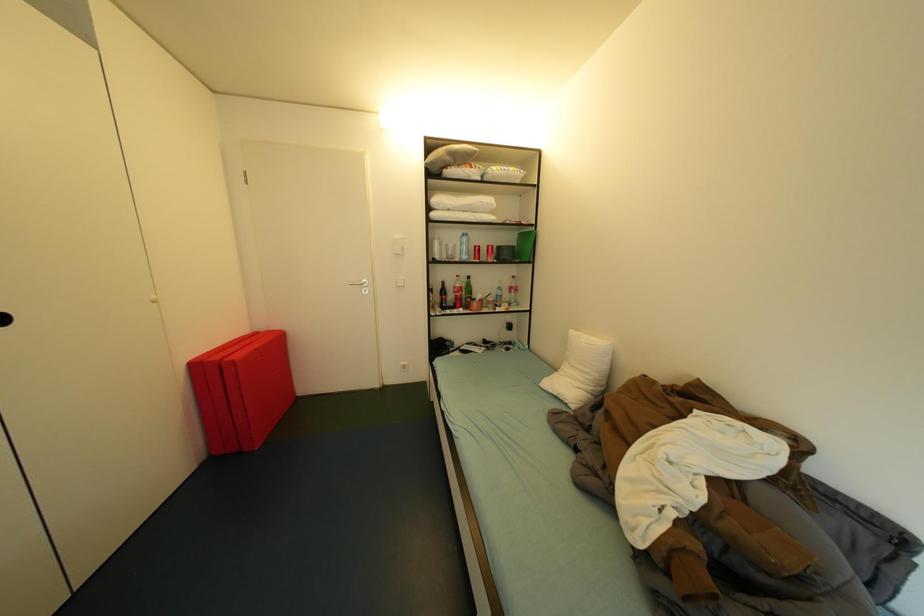
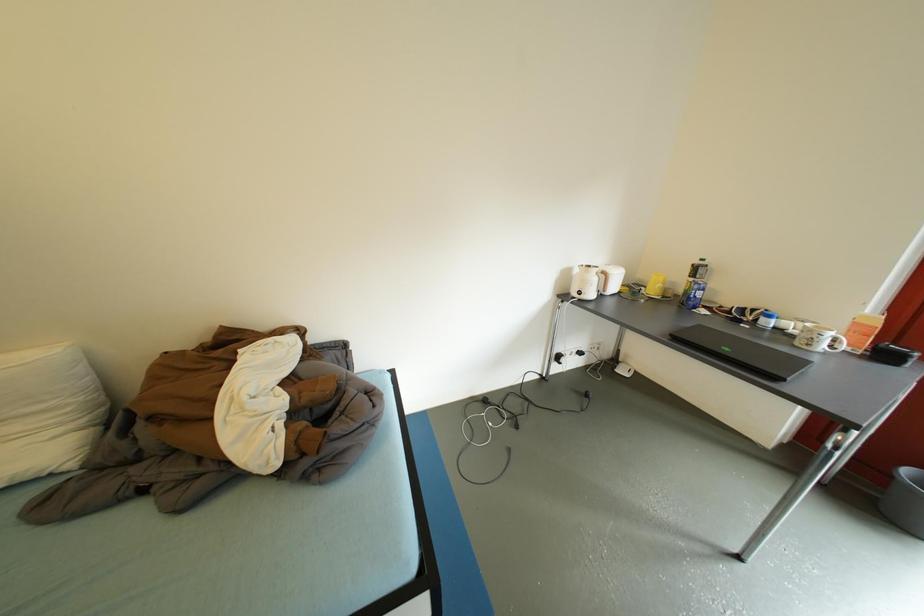
The first image is from the beginning of the video and the second image is from the end. How did the camera likely rotate when shooting the video?

The rotation direction of the camera is right-down.